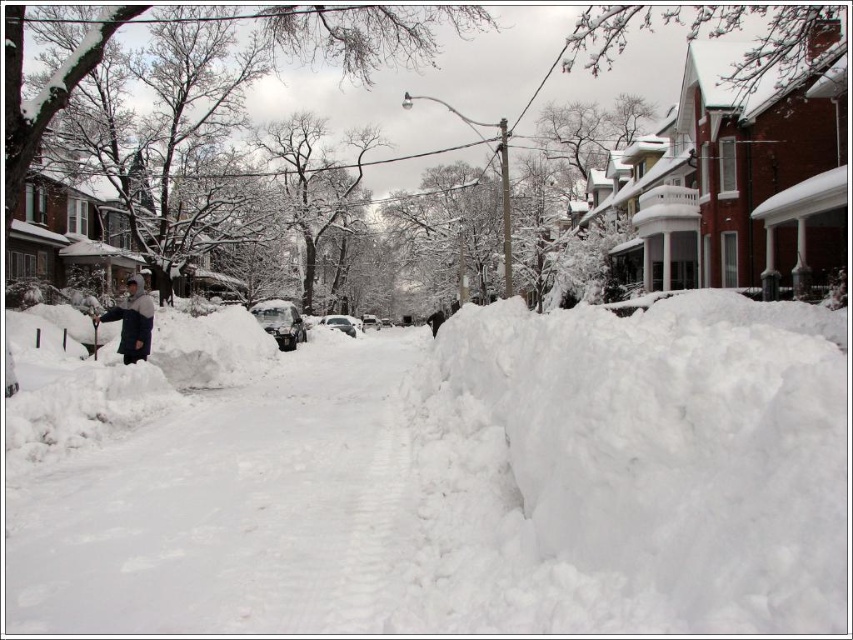
Does point (509, 413) come in front of point (273, 310)?

Yes, point (509, 413) is in front of point (273, 310).

Which is in front, point (531, 381) or point (277, 324)?

Point (531, 381) is more forward.

Is point (778, 356) farther from camera compared to point (263, 314)?

No.

Locate an element on the screen. This screenshot has height=640, width=853. white fluffy snow at lower right is located at coordinates (633, 468).

Does white snow pavement at center appear under white matte car at center?

Yes, white snow pavement at center is below white matte car at center.

Consider the image. Is white snow pavement at center further to the viewer compared to white matte car at center?

No.

Is point (149, 524) farther from viewer compared to point (283, 340)?

No, it is in front of (283, 340).

Identify the location of white snow pavement at center. The image size is (853, 640). (228, 508).

Where is `white fluffy snow at lower right`? The height and width of the screenshot is (640, 853). white fluffy snow at lower right is located at coordinates (633, 468).

This screenshot has width=853, height=640. I want to click on white fluffy snow at lower right, so click(633, 468).